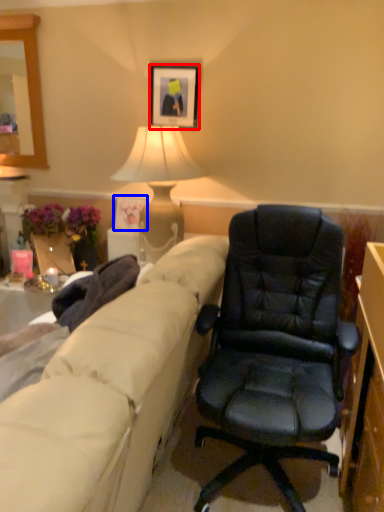
Question: Which object appears farthest to the camera in this image, picture frame (highlighted by a red box) or picture frame (highlighted by a blue box)?

Choices:
 (A) picture frame
 (B) picture frame

Answer: (B)